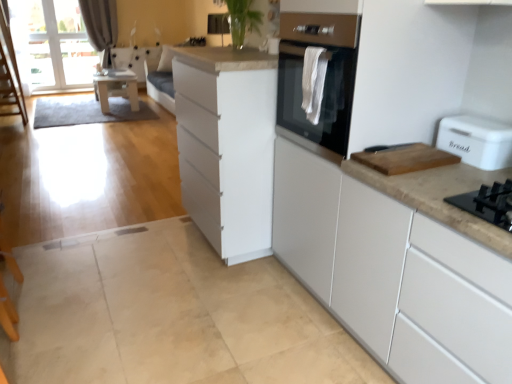
Question: Should I look upward or downward to see gray fabric curtain at upper left?

Choices:
 (A) up
 (B) down

Answer: (A)

Question: Does wooden cutting board at right come in front of transparent glass window screen at upper left?

Choices:
 (A) no
 (B) yes

Answer: (B)

Question: Does wooden cutting board at right have a greater width compared to transparent glass window screen at upper left?

Choices:
 (A) yes
 (B) no

Answer: (A)

Question: Is wooden cutting board at right outside of transparent glass window screen at upper left?

Choices:
 (A) no
 (B) yes

Answer: (B)

Question: Is wooden cutting board at right oriented towards transparent glass window screen at upper left?

Choices:
 (A) yes
 (B) no

Answer: (B)

Question: Does wooden cutting board at right appear on the left side of transparent glass window screen at upper left?

Choices:
 (A) yes
 (B) no

Answer: (B)

Question: From a real-world perspective, is wooden cutting board at right over transparent glass window screen at upper left?

Choices:
 (A) yes
 (B) no

Answer: (A)

Question: Is white matte cabinet at center, which is counted as the 1th cabinetry, starting from the right, bigger than white plastic bread bin at right?

Choices:
 (A) yes
 (B) no

Answer: (A)

Question: Does white matte cabinet at center, which is counted as the 1th cabinetry, starting from the right, touch white plastic bread bin at right?

Choices:
 (A) yes
 (B) no

Answer: (B)

Question: From the image's perspective, would you say white matte cabinet at center, which is counted as the 1th cabinetry, starting from the right, is positioned over white plastic bread bin at right?

Choices:
 (A) no
 (B) yes

Answer: (A)

Question: Is white matte cabinet at center, which is counted as the 1th cabinetry, starting from the right, far from white plastic bread bin at right?

Choices:
 (A) no
 (B) yes

Answer: (A)

Question: Does white matte cabinet at center, the 2th cabinetry in the left-to-right sequence, have a lesser width compared to white plastic bread bin at right?

Choices:
 (A) no
 (B) yes

Answer: (A)

Question: Is white matte cabinet at center, the 2th cabinetry in the left-to-right sequence, located outside white plastic bread bin at right?

Choices:
 (A) no
 (B) yes

Answer: (B)

Question: Does white matte cabinet at center, marked as the 2th cabinetry in a right-to-left arrangement, have a lesser width compared to gray fabric curtain at upper left?

Choices:
 (A) no
 (B) yes

Answer: (A)